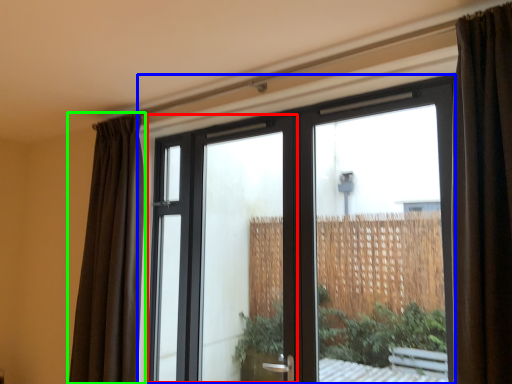
Question: Which object is the closest to the screen door (highlighted by a red box)? Choose among these: window (highlighted by a blue box) or curtain (highlighted by a green box).

Choices:
 (A) window
 (B) curtain

Answer: (B)